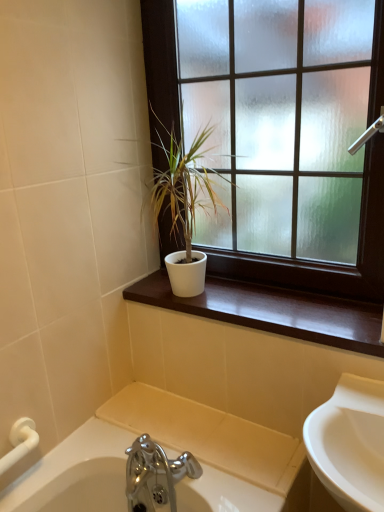
Where is `blank space situated above white glossy window sill at center (from a real-world perspective)`? blank space situated above white glossy window sill at center (from a real-world perspective) is located at coordinates (266, 303).